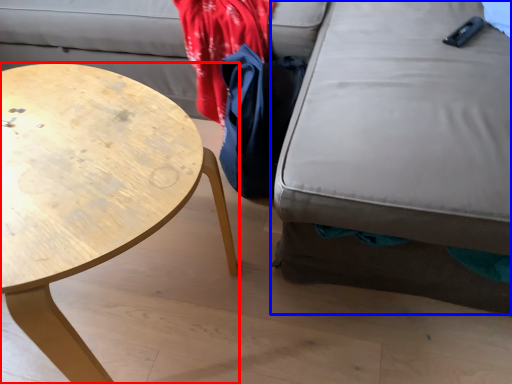
Question: Among these objects, which one is nearest to the camera, coffee table (highlighted by a red box) or swivel chair (highlighted by a blue box)?

Choices:
 (A) coffee table
 (B) swivel chair

Answer: (B)